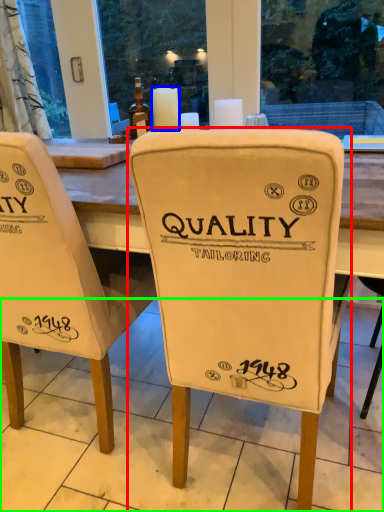
Question: Based on their relative distances, which object is farther from chair (highlighted by a red box)? Choose from candle (highlighted by a blue box) and tile (highlighted by a green box).

Choices:
 (A) candle
 (B) tile

Answer: (A)